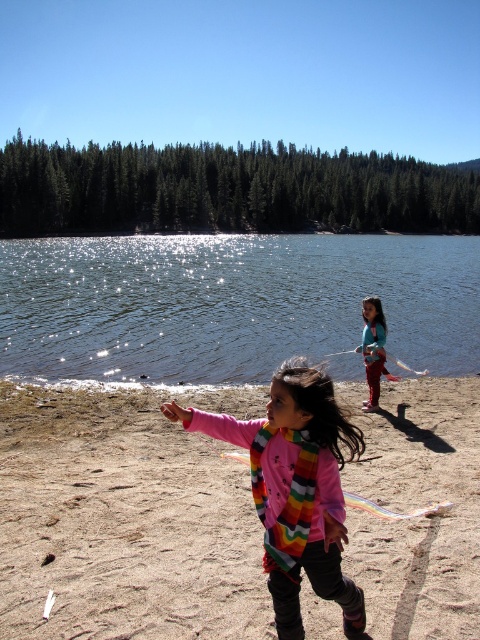
Question: Among these objects, which one is farthest from the camera?

Choices:
 (A) smooth beige sand at lower center
 (B) sparkling water at lake center

Answer: (B)

Question: Among these objects, which one is nearest to the camera?

Choices:
 (A) smooth beige sand at lower center
 (B) sparkling water at lake center

Answer: (A)

Question: Can you confirm if smooth beige sand at lower center is positioned to the left of multicolored scarf at right?

Choices:
 (A) no
 (B) yes

Answer: (B)

Question: Which point is closer to the camera?

Choices:
 (A) multicolored scarf at right
 (B) sparkling water at lake center
 (C) smooth beige sand at lower center

Answer: (C)

Question: Can you confirm if sparkling water at lake center is positioned above multicolored scarf at right?

Choices:
 (A) no
 (B) yes

Answer: (B)

Question: Is smooth beige sand at lower center bigger than sparkling water at lake center?

Choices:
 (A) no
 (B) yes

Answer: (A)